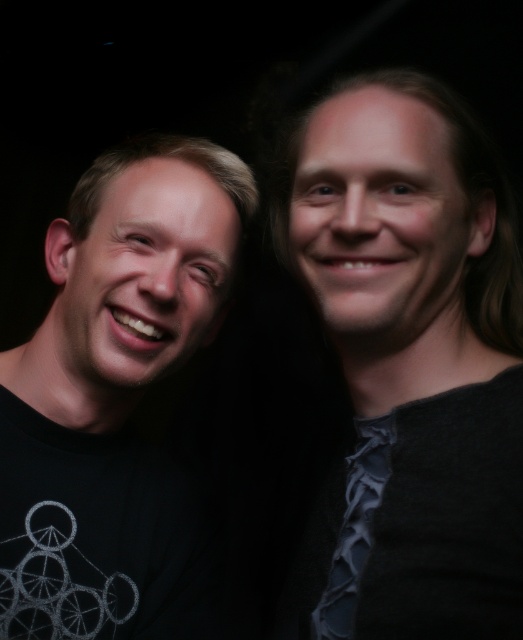
You are a photographer adjusting the focus on a camera. You need to focus on the gray wool sweater at upper right. What are the coordinates where you should adjust the focus?

The coordinates to focus on the gray wool sweater at upper right are point [410,365].